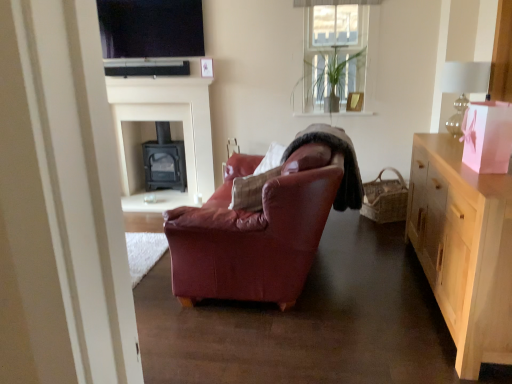
Question: Should I look upward or downward to see black matte fireplace at center, acting as the 2th fireplace starting from the back?

Choices:
 (A) up
 (B) down

Answer: (A)

Question: Does black matte fireplace at center, marked as the 2th fireplace in a front-to-back arrangement, touch matte black tv at upper center?

Choices:
 (A) yes
 (B) no

Answer: (B)

Question: Does black matte fireplace at center, marked as the 2th fireplace in a front-to-back arrangement, have a lesser height compared to matte black tv at upper center?

Choices:
 (A) no
 (B) yes

Answer: (A)

Question: Does black matte fireplace at center, the 1th fireplace positioned from the back, have a greater width compared to matte black tv at upper center?

Choices:
 (A) no
 (B) yes

Answer: (B)

Question: From a real-world perspective, is black matte fireplace at center, marked as the 2th fireplace in a front-to-back arrangement, under matte black tv at upper center?

Choices:
 (A) no
 (B) yes

Answer: (B)

Question: Does black matte fireplace at center, the 1th fireplace positioned from the back, have a lesser width compared to matte black tv at upper center?

Choices:
 (A) no
 (B) yes

Answer: (A)

Question: Does clear glass lampshade at upper right have a greater height compared to black matte fireplace at center, marked as the 2th fireplace in a front-to-back arrangement?

Choices:
 (A) no
 (B) yes

Answer: (A)

Question: Does clear glass lampshade at upper right appear on the right side of black matte fireplace at center, the 1th fireplace positioned from the back?

Choices:
 (A) yes
 (B) no

Answer: (A)

Question: Does clear glass lampshade at upper right come in front of black matte fireplace at center, the 1th fireplace positioned from the back?

Choices:
 (A) no
 (B) yes

Answer: (B)

Question: Is clear glass lampshade at upper right bigger than black matte fireplace at center, marked as the 2th fireplace in a front-to-back arrangement?

Choices:
 (A) yes
 (B) no

Answer: (B)

Question: Could you tell me if clear glass lampshade at upper right is facing black matte fireplace at center, marked as the 2th fireplace in a front-to-back arrangement?

Choices:
 (A) yes
 (B) no

Answer: (B)

Question: Would you say clear glass lampshade at upper right is outside black matte fireplace at center, the 1th fireplace positioned from the back?

Choices:
 (A) yes
 (B) no

Answer: (A)

Question: Is the depth of matte black tv at upper center less than that of woven brown picnic basket at right?

Choices:
 (A) no
 (B) yes

Answer: (A)